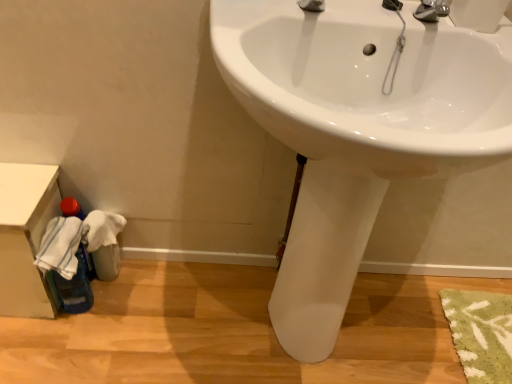
Locate an element on the screen. vacant area located to the right-hand side of white glossy sink at center is located at coordinates pyautogui.click(x=445, y=319).